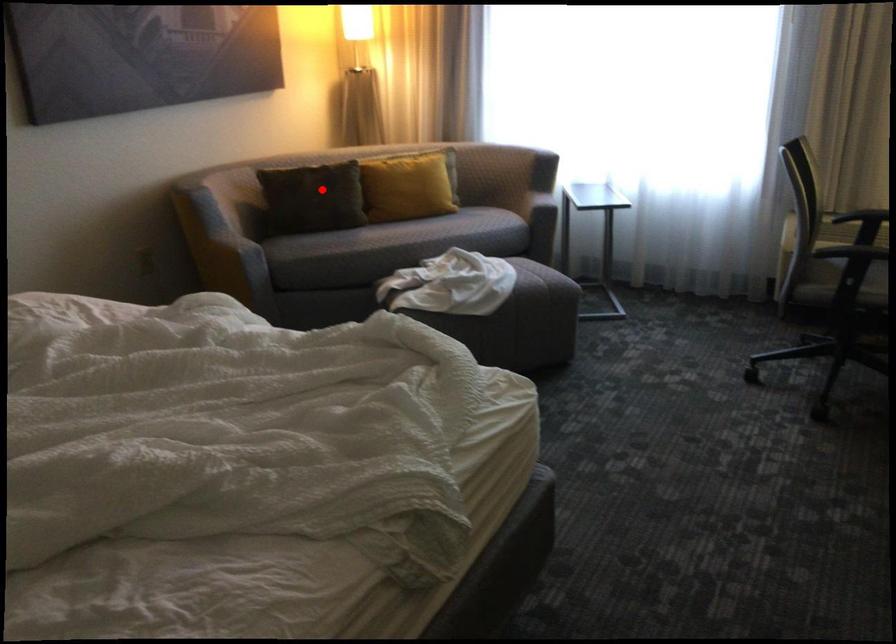
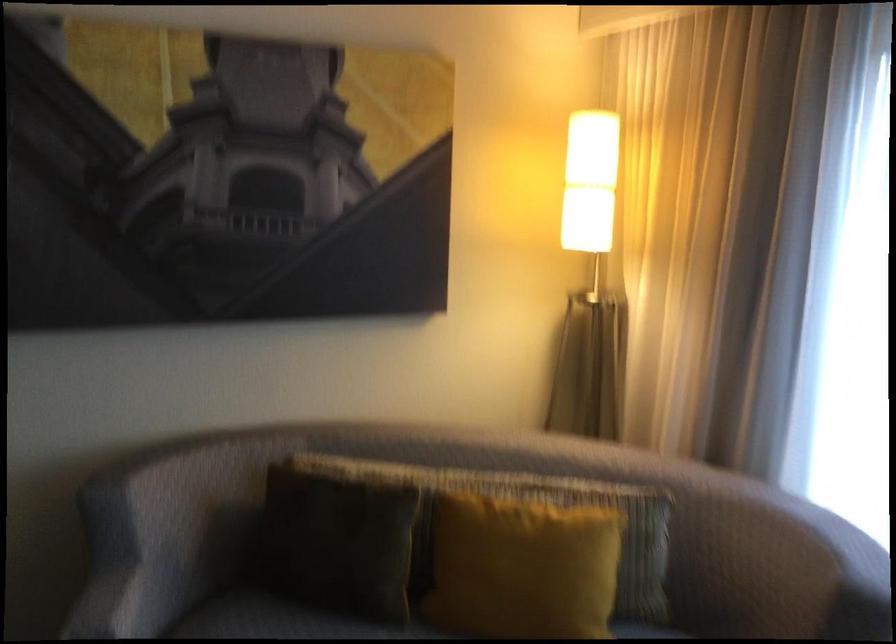
Where in the second image is the point corresponding to the highlighted location from the first image?

(339, 542)